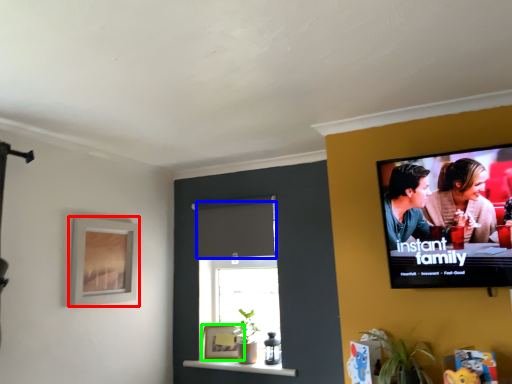
Question: Which object is positioned farthest from picture frame (highlighted by a red box)? Select from curtain (highlighted by a blue box) and picture frame (highlighted by a green box).

Choices:
 (A) curtain
 (B) picture frame

Answer: (B)